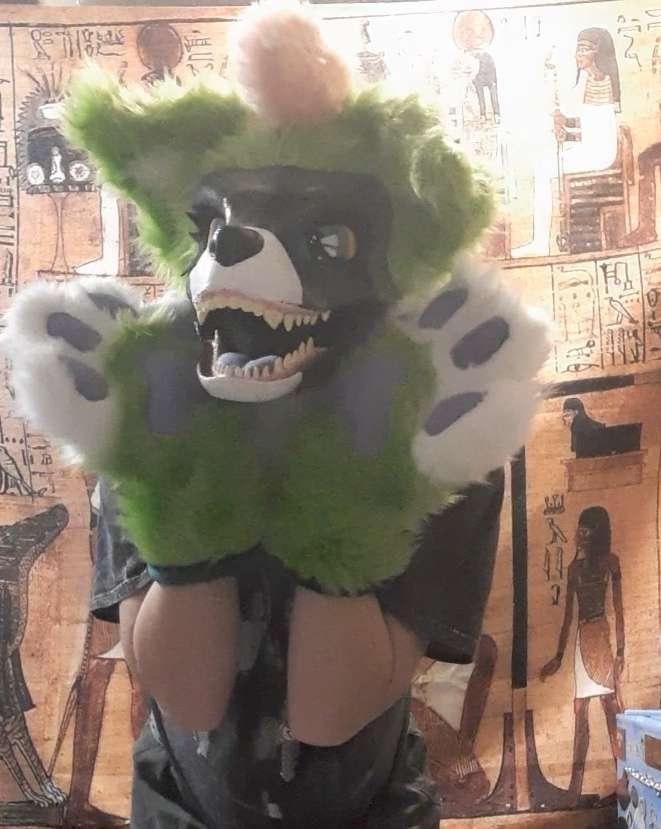
Find the location of a particular element. wall is located at coordinates (552, 462).